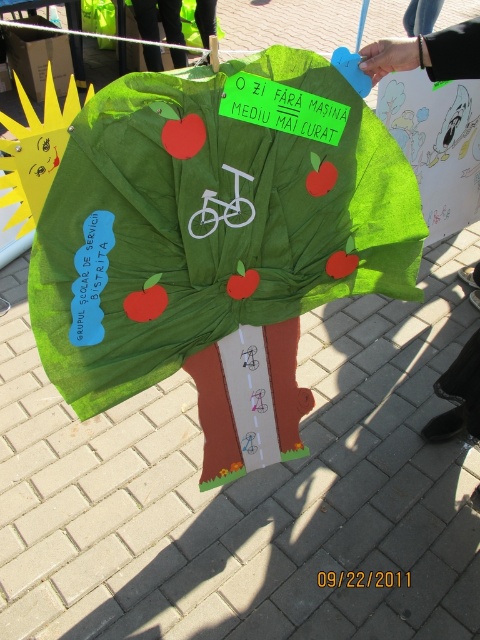
Question: Based on their relative distances, which object is nearer to the green fabric umbrella at center?

Choices:
 (A) black fabric handbag at upper right
 (B) green fabric at center

Answer: (A)

Question: Among these objects, which one is nearest to the camera?

Choices:
 (A) green fabric umbrella at center
 (B) black fabric handbag at upper right

Answer: (A)

Question: Can you confirm if green fabric umbrella at center is positioned below green fabric at center?

Choices:
 (A) no
 (B) yes

Answer: (B)

Question: Does green fabric umbrella at center appear over black fabric handbag at upper right?

Choices:
 (A) no
 (B) yes

Answer: (B)

Question: Which point is farther from the camera taking this photo?

Choices:
 (A) click(170, 40)
 (B) click(97, 220)

Answer: (A)

Question: Does black fabric handbag at upper right appear under green fabric at center?

Choices:
 (A) yes
 (B) no

Answer: (A)